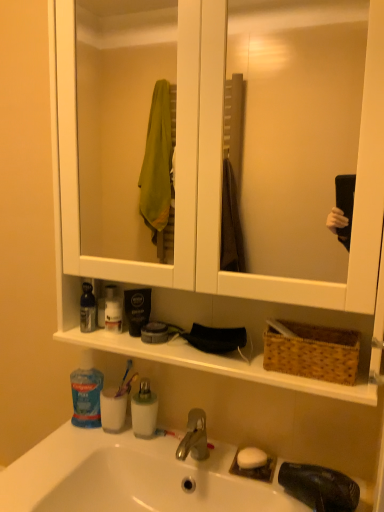
Locate an element on the screen. The height and width of the screenshot is (512, 384). vacant area that is in front of white matte soap at sink is located at coordinates (265, 488).